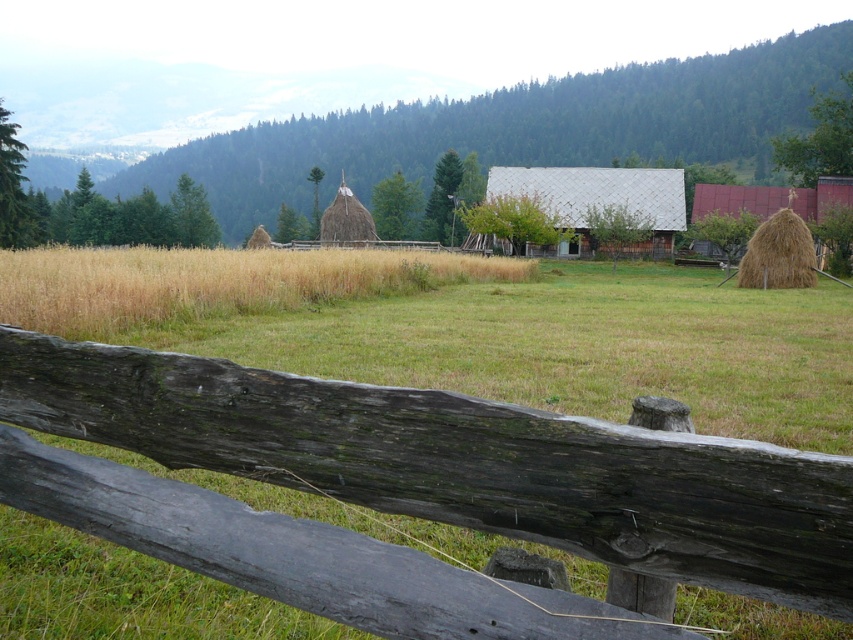
Question: Which object is closer to the camera taking this photo?

Choices:
 (A) wooden planks barn at center
 (B) brown straw bale at right
 (C) yellow dry grass at center
 (D) weathered wood fence at center

Answer: (D)

Question: Which of the following is the closest to the observer?

Choices:
 (A) (492, 196)
 (B) (815, 262)

Answer: (B)

Question: Does wooden planks barn at center have a larger size compared to brown straw bale at right?

Choices:
 (A) yes
 (B) no

Answer: (A)

Question: Observing the image, what is the correct spatial positioning of weathered wood fence at center in reference to yellow dry grass at center?

Choices:
 (A) below
 (B) above

Answer: (A)

Question: From the image, what is the correct spatial relationship of yellow dry grass at center in relation to wooden planks barn at center?

Choices:
 (A) above
 (B) below

Answer: (B)

Question: Which of the following is the closest to the observer?

Choices:
 (A) wooden planks barn at center
 (B) brown straw bale at right
 (C) weathered wood fence at center
 (D) yellow dry grass at center

Answer: (C)